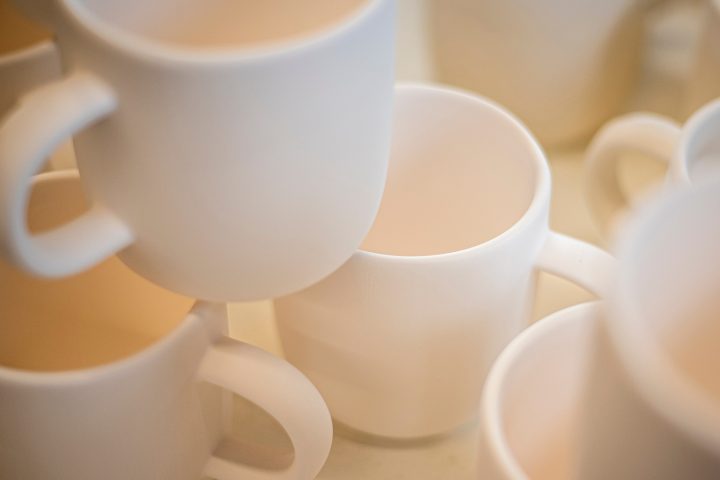
Where is `coffee cup`? The width and height of the screenshot is (720, 480). coffee cup is located at coordinates (234, 139), (153, 384), (374, 310), (495, 422), (621, 357), (675, 147), (540, 33), (24, 60).